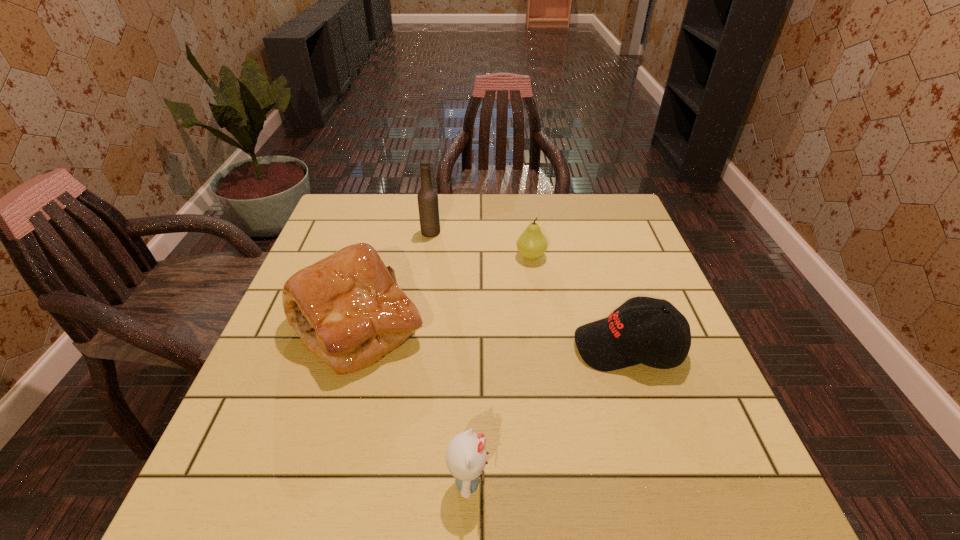
Identify the location of blank space that satisfies the following two spatial constraints: 1. on the side of the second farthest object with the label; 2. on the right side of the tallest object. click(x=427, y=256).